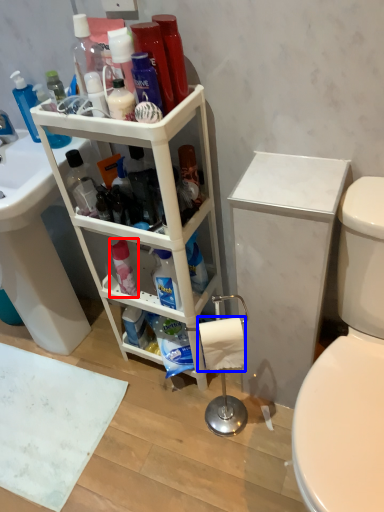
Question: Which object appears closest to the camera in this image, cleaning product (highlighted by a red box) or toilet paper (highlighted by a blue box)?

Choices:
 (A) cleaning product
 (B) toilet paper

Answer: (B)